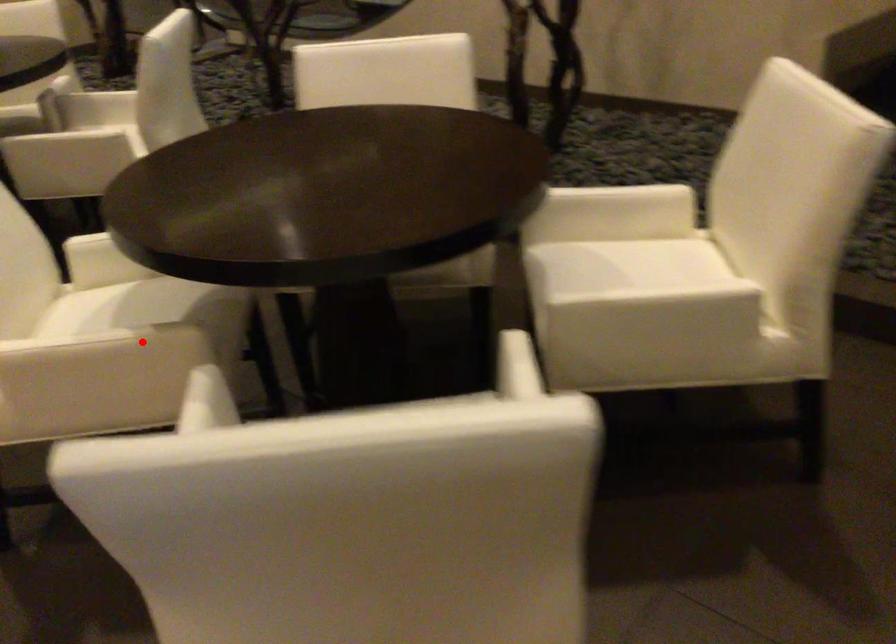
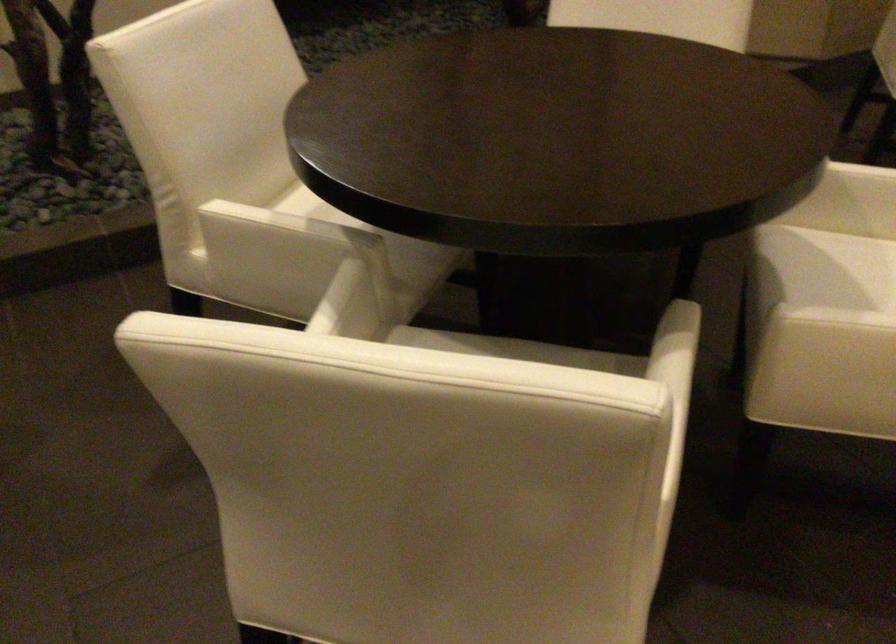
Question: A red point is marked in image1. In image2, is the corresponding 3D point closer to the camera or farther? Reply with the corresponding letter.

Choices:
 (A) The corresponding 3D point is closer.
 (B) The corresponding 3D point is farther.

Answer: (A)